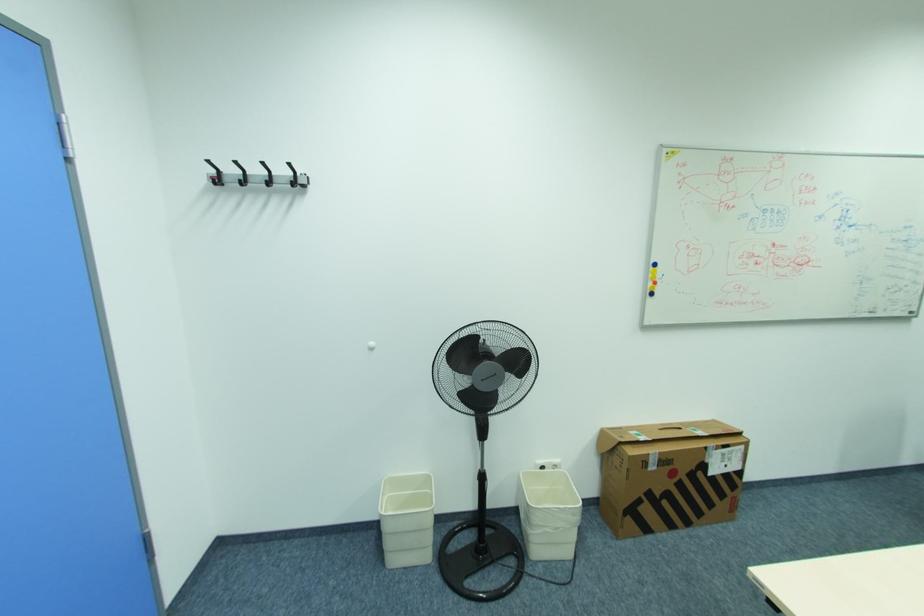
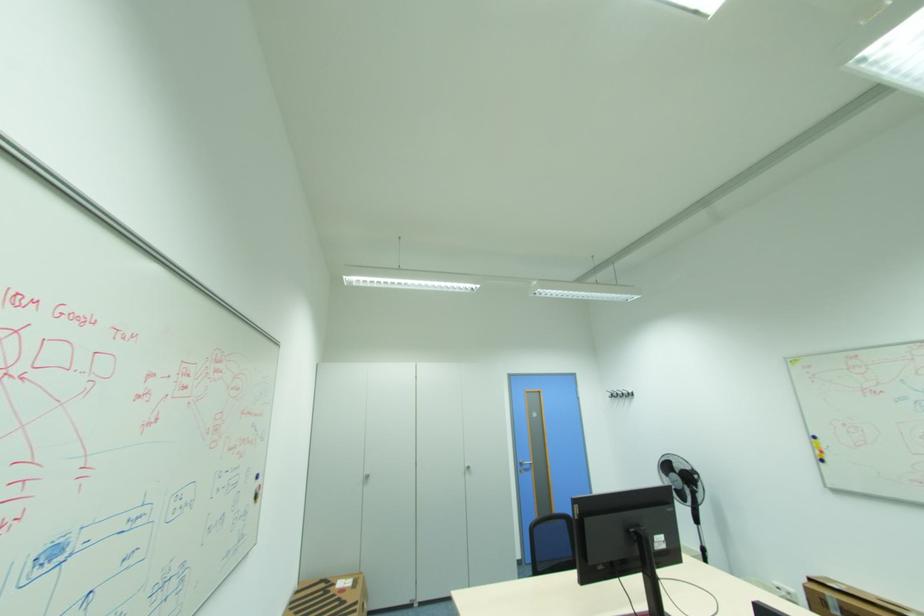
Locate, in the second image, the point that corresponds to [213,161] in the first image.

(613, 391)